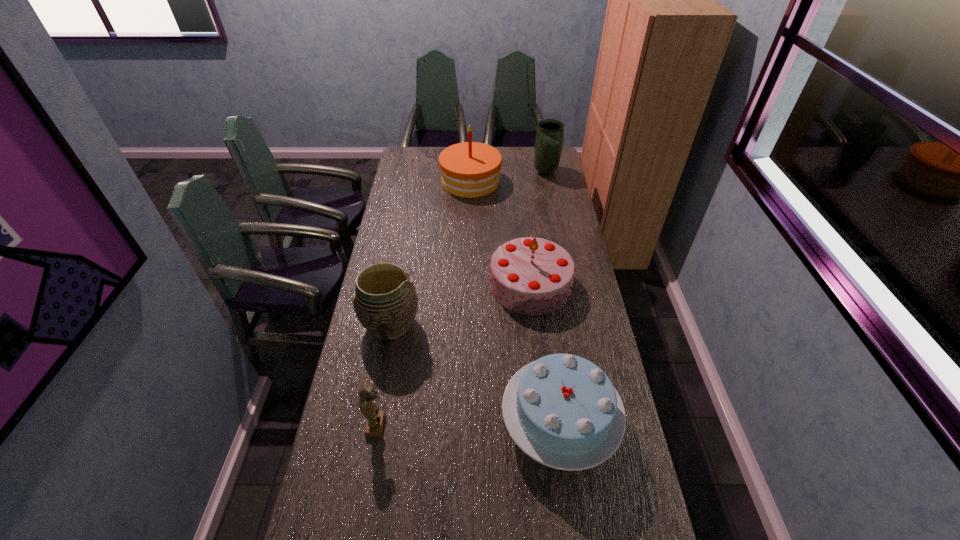
At what (x,y) coordinates should I click in order to perform the action: click on free space between the second nearest birthday cake and the pottery. Please return your answer as a coordinate pair (x, y). Looking at the image, I should click on (461, 304).

Locate an element on the screen. This screenshot has height=540, width=960. object that is the closest to the vase is located at coordinates (470, 169).

Locate which object ranks third in proximity to the figurine. Please provide its 2D coordinates. Your answer should be formatted as a tuple, i.e. [(x, y)], where the tuple contains the x and y coordinates of a point satisfying the conditions above.

[(533, 276)]

At what (x,y) coordinates should I click in order to perform the action: click on birthday cake that is the second closest to the second farthest birthday cake. Please return your answer as a coordinate pair (x, y). The image size is (960, 540). Looking at the image, I should click on (470, 169).

Identify which birthday cake is located as the second nearest to the nearest birthday cake. Please provide its 2D coordinates. Your answer should be formatted as a tuple, i.e. [(x, y)], where the tuple contains the x and y coordinates of a point satisfying the conditions above.

[(470, 169)]

The height and width of the screenshot is (540, 960). I want to click on free region that satisfies the following two spatial constraints: 1. on the back side of the pottery; 2. on the right side of the tallest birthday cake, so click(417, 181).

Where is `vacant area that satisfies the following two spatial constraints: 1. on the back side of the farthest birthday cake; 2. on the right side of the vase`? Image resolution: width=960 pixels, height=540 pixels. vacant area that satisfies the following two spatial constraints: 1. on the back side of the farthest birthday cake; 2. on the right side of the vase is located at coordinates point(471,172).

Locate an element on the screen. The height and width of the screenshot is (540, 960). vacant space that satisfies the following two spatial constraints: 1. on the front side of the tallest birthday cake; 2. on the front-facing side of the figurine is located at coordinates (465, 426).